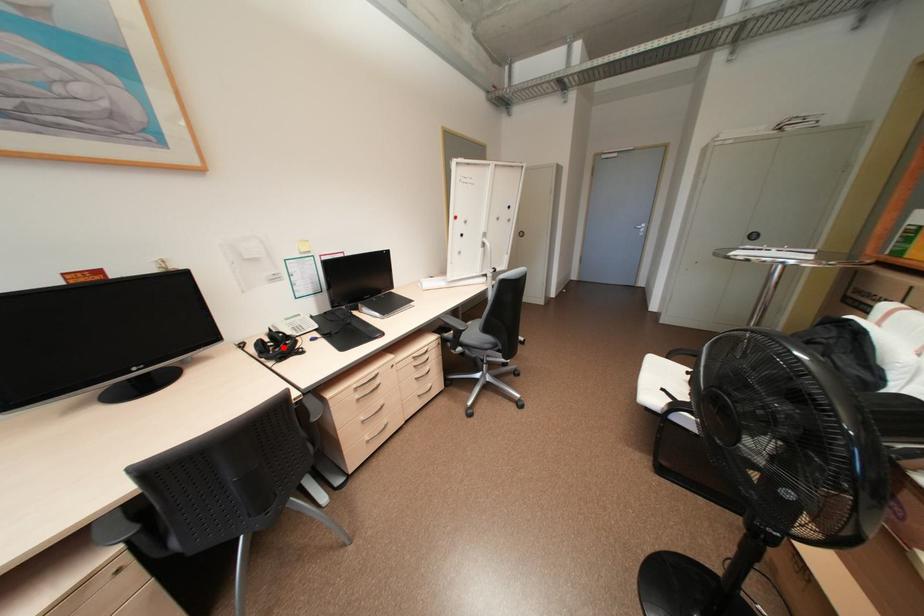
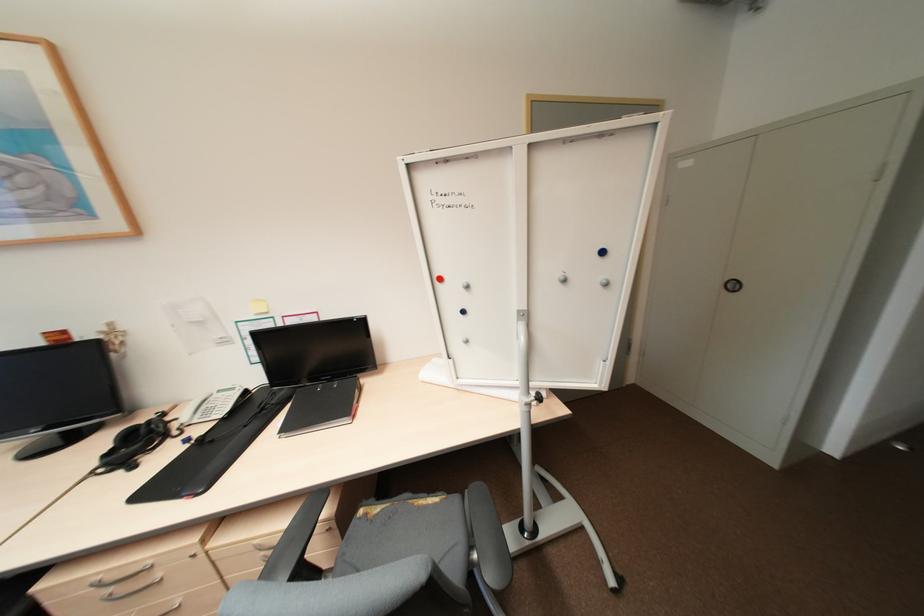
Where in the second image is the point corresponding to the highlighted location from the first image?

(142, 444)